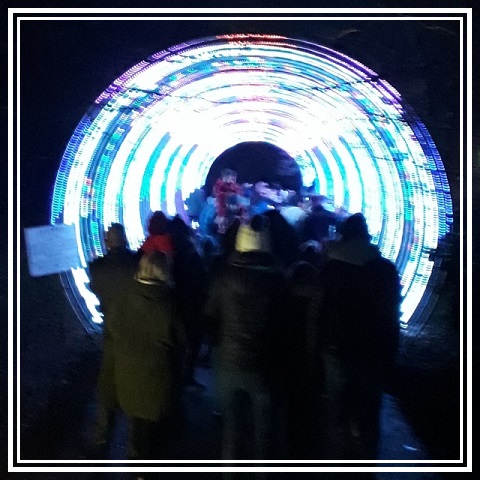
In order to click on white borders in this screenshot , I will do `click(70, 472)`, `click(67, 462)`, `click(468, 291)`, `click(460, 254)`, `click(378, 7)`, `click(274, 18)`, `click(11, 264)`, `click(17, 236)`.